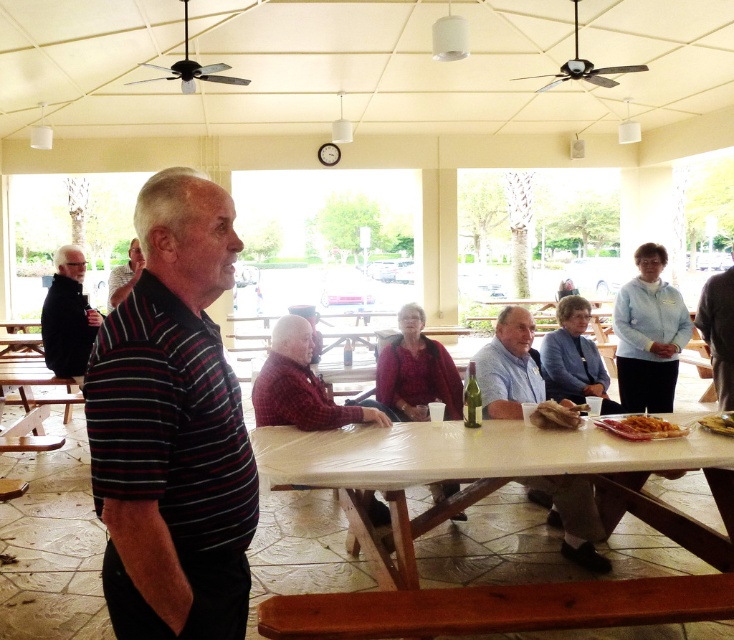
Is white plastic table at center above brown crumbly bread at center?

Actually, white plastic table at center is below brown crumbly bread at center.

Locate an element on the screen. The image size is (734, 640). white plastic table at center is located at coordinates (454, 468).

Does red plaid shirt at center have a lesser width compared to brown crumbly bread at center?

Incorrect, red plaid shirt at center's width is not less than brown crumbly bread at center's.

Which is more to the left, red plaid shirt at center or brown crumbly bread at center?

From the viewer's perspective, red plaid shirt at center appears more on the left side.

Is point (279, 417) more distant than point (552, 412)?

Yes.

Where is `red plaid shirt at center`? The image size is (734, 640). red plaid shirt at center is located at coordinates (299, 385).

Is white plastic table at center further to camera compared to light blue cotton shirt at center?

That is False.

Can you confirm if white plastic table at center is shorter than light blue cotton shirt at center?

In fact, white plastic table at center may be taller than light blue cotton shirt at center.

Does point (390, 452) come in front of point (479, 376)?

Yes, point (390, 452) is closer to viewer.

Identify the location of white plastic table at center. (454, 468).